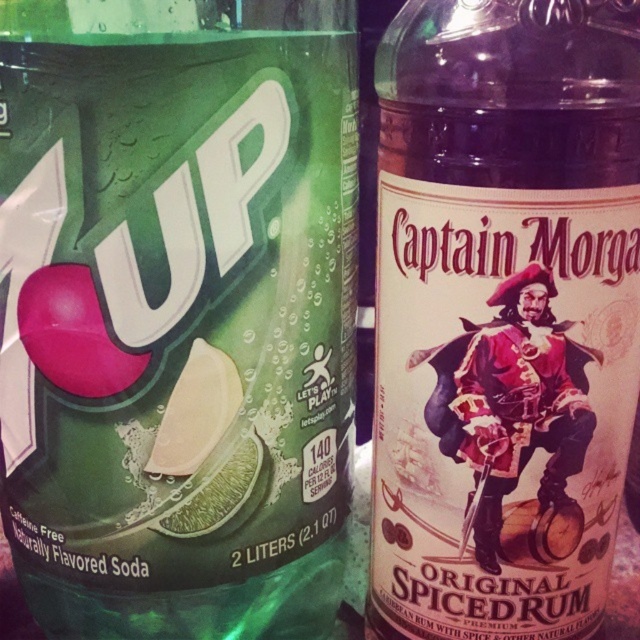
Question: Which object appears farthest from the camera in this image?

Choices:
 (A) translucent glass bottle at right
 (B) green matte soda bottle at center

Answer: (B)

Question: Is green matte soda bottle at center bigger than translucent glass bottle at right?

Choices:
 (A) yes
 (B) no

Answer: (A)

Question: Is green matte soda bottle at center thinner than translucent glass bottle at right?

Choices:
 (A) no
 (B) yes

Answer: (A)

Question: Where is translucent glass bottle at right located in relation to green matte lime at center in the image?

Choices:
 (A) left
 (B) right

Answer: (B)

Question: Which object is the farthest from the green matte soda bottle at center?

Choices:
 (A) green matte lime at center
 (B) translucent glass bottle at right

Answer: (B)

Question: Which point is closer to the camera?

Choices:
 (A) (211, 477)
 (B) (572, 349)
 (C) (32, 81)

Answer: (C)